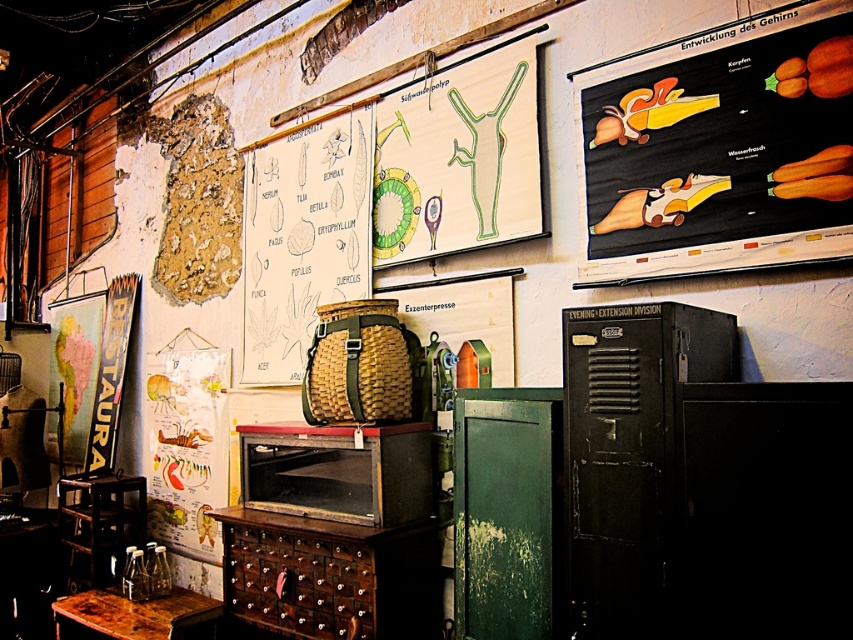
Question: Which object is closer to the camera taking this photo?

Choices:
 (A) white paper at center
 (B) black matte poster at upper right
 (C) yellow paper poster at left
 (D) wooden stool at lower left

Answer: (B)

Question: Can you confirm if metallic gray oven at center is thinner than yellow paper poster at left?

Choices:
 (A) yes
 (B) no

Answer: (B)

Question: Among these points, which one is nearest to the camera?

Choices:
 (A) (288, 282)
 (B) (294, 612)
 (C) (157, 365)

Answer: (B)

Question: Can you confirm if black matte poster at upper right is positioned below wooden stool at lower left?

Choices:
 (A) no
 (B) yes

Answer: (A)

Question: Which object appears closest to the camera in this image?

Choices:
 (A) metallic gray oven at center
 (B) green wood drawing at upper center

Answer: (A)

Question: Is black matte poster at upper right below black metal locker at center?

Choices:
 (A) yes
 (B) no

Answer: (B)